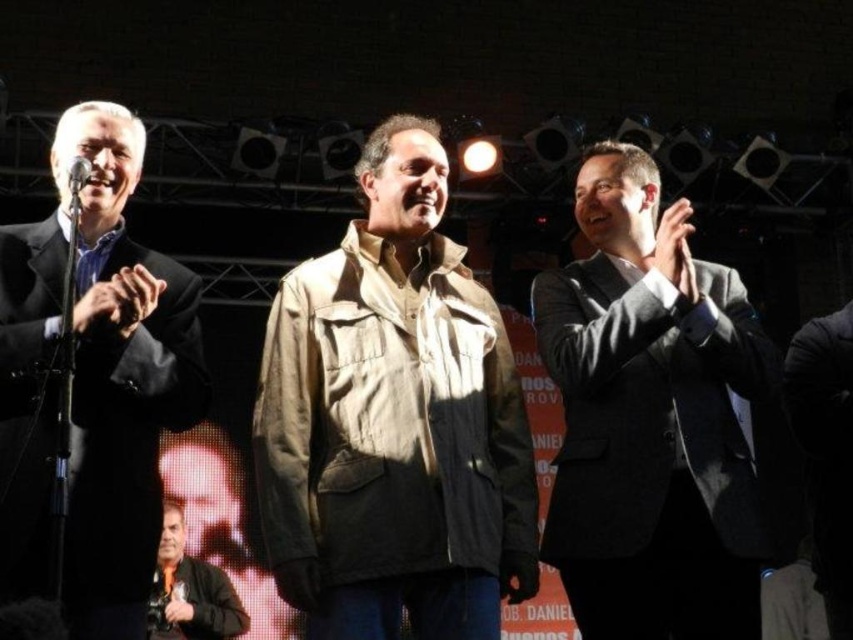
Between matte black suit at left and matte black microphone at left, which one has more height?

matte black suit at left

Is matte black suit at left above matte black microphone at left?

No.

Between point (123, 115) and point (90, 170), which one is positioned in front?

Positioned in front is point (90, 170).

Where is `matte black suit at left`? The image size is (853, 640). matte black suit at left is located at coordinates (93, 384).

Does tan fabric jacket at center appear on the left side of gray suit at right?

Yes, tan fabric jacket at center is to the left of gray suit at right.

Can you confirm if tan fabric jacket at center is thinner than gray suit at right?

No, tan fabric jacket at center is not thinner than gray suit at right.

Does point (524, 522) come farther from viewer compared to point (749, 573)?

Yes, point (524, 522) is farther from viewer.

Locate an element on the screen. tan fabric jacket at center is located at coordinates (393, 420).

Who is shorter, tan fabric jacket at center or dark brown leather jacket at lower left?

dark brown leather jacket at lower left is shorter.

Does tan fabric jacket at center have a greater height compared to dark brown leather jacket at lower left?

Correct, tan fabric jacket at center is much taller as dark brown leather jacket at lower left.

Describe the element at coordinates (393, 420) in the screenshot. I see `tan fabric jacket at center` at that location.

This screenshot has width=853, height=640. In order to click on tan fabric jacket at center in this screenshot , I will do `click(393, 420)`.